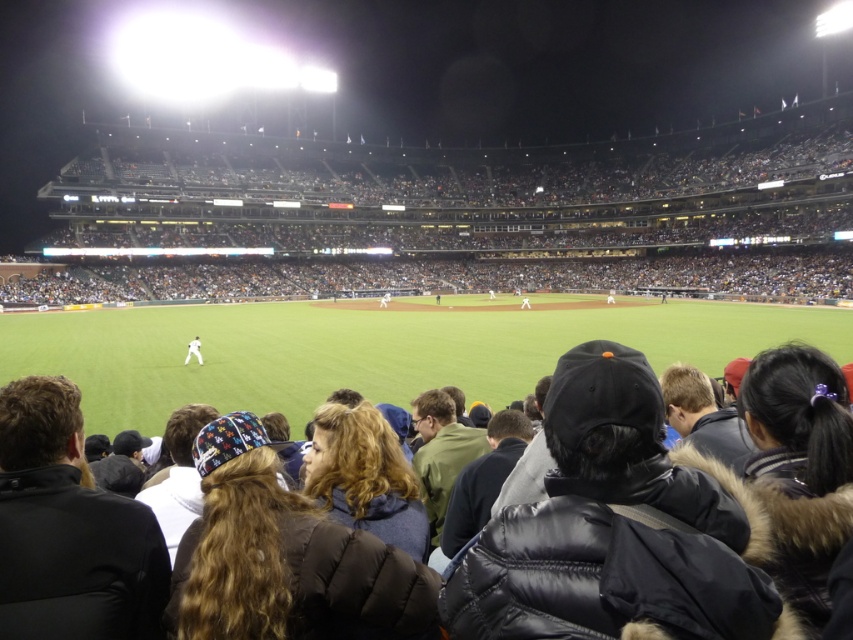
Question: Which object is closer to the camera taking this photo?

Choices:
 (A) black puffy coat at center
 (B) white matte baseball player at center

Answer: (A)

Question: Is black puffy coat at center further to the viewer compared to white matte baseball player at center?

Choices:
 (A) yes
 (B) no

Answer: (B)

Question: Among these points, which one is nearest to the camera?

Choices:
 (A) (187, 362)
 (B) (837, 419)

Answer: (B)

Question: Is black puffy coat at center to the left of white matte baseball player at center from the viewer's perspective?

Choices:
 (A) no
 (B) yes

Answer: (A)

Question: Does black puffy coat at center appear under white matte baseball player at center?

Choices:
 (A) yes
 (B) no

Answer: (B)